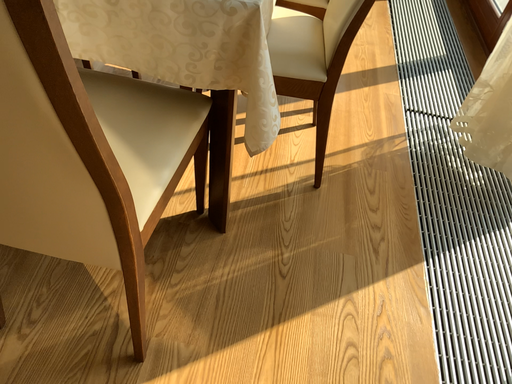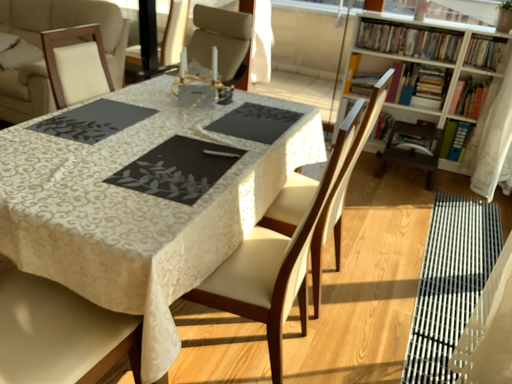
Question: How did the camera likely rotate when shooting the video?

Choices:
 (A) rotated left
 (B) rotated right

Answer: (A)